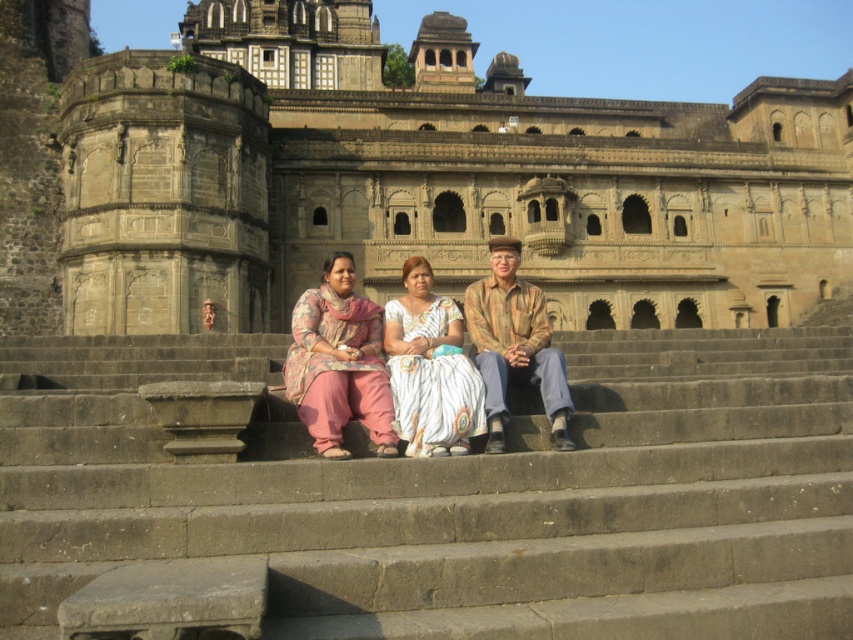
Does brown stone stairs at center have a smaller size compared to white textured saree at center?

Actually, brown stone stairs at center might be larger than white textured saree at center.

Where is `brown stone stairs at center`? The height and width of the screenshot is (640, 853). brown stone stairs at center is located at coordinates (433, 499).

Does stone carved palace at center appear over white textured saree at center?

Correct, stone carved palace at center is located above white textured saree at center.

Who is more forward, (x=199, y=285) or (x=434, y=429)?

Point (x=434, y=429) is more forward.

The width and height of the screenshot is (853, 640). In order to click on stone carved palace at center in this screenshot , I will do `click(390, 177)`.

Which is behind, point (546, 324) or point (433, 419)?

The point (546, 324) is more distant.

The width and height of the screenshot is (853, 640). I want to click on plaid fabric shirt at center, so click(x=514, y=344).